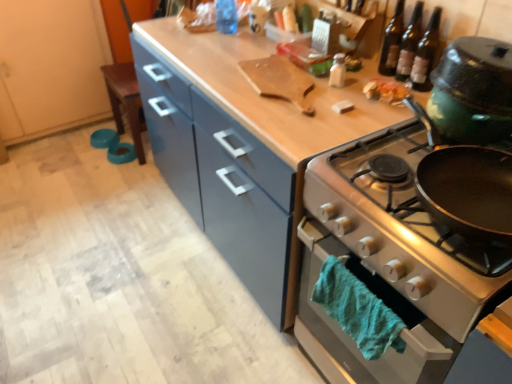
Question: Which direction should I rotate to look at transparent plastic bottle at upper center, acting as the first bottle starting from the left?

Choices:
 (A) right
 (B) left

Answer: (B)

Question: Is transparent plastic bottle at upper center, the second bottle when ordered from front to back, taller than teal fuzzy towel at lower right?

Choices:
 (A) no
 (B) yes

Answer: (B)

Question: Is transparent plastic bottle at upper center, which appears as the 2th bottle when ordered from the bottom, wider than teal fuzzy towel at lower right?

Choices:
 (A) no
 (B) yes

Answer: (B)

Question: Is transparent plastic bottle at upper center, which appears as the 2th bottle when ordered from the bottom, shorter than teal fuzzy towel at lower right?

Choices:
 (A) yes
 (B) no

Answer: (B)

Question: Is there a large distance between transparent plastic bottle at upper center, which appears as the 2th bottle when ordered from the bottom, and teal fuzzy towel at lower right?

Choices:
 (A) no
 (B) yes

Answer: (B)

Question: From a real-world perspective, is transparent plastic bottle at upper center, acting as the 1th bottle starting from the back, beneath teal fuzzy towel at lower right?

Choices:
 (A) yes
 (B) no

Answer: (B)

Question: Is transparent plastic bottle at upper center, the second bottle when ordered from front to back, closer to the viewer compared to teal fuzzy towel at lower right?

Choices:
 (A) yes
 (B) no

Answer: (B)

Question: Can you confirm if shiny plastic container at upper right is taller than translucent glass bottles at upper right, which is counted as the 1th beer bottle, starting from the right?

Choices:
 (A) yes
 (B) no

Answer: (B)

Question: From a real-world perspective, is shiny plastic container at upper right located higher than translucent glass bottles at upper right, which is counted as the 1th beer bottle, starting from the right?

Choices:
 (A) no
 (B) yes

Answer: (A)

Question: From the image's perspective, does shiny plastic container at upper right appear higher than translucent glass bottles at upper right, placed as the 2th beer bottle when sorted from left to right?

Choices:
 (A) no
 (B) yes

Answer: (A)

Question: Does shiny plastic container at upper right have a greater width compared to translucent glass bottles at upper right, placed as the 2th beer bottle when sorted from left to right?

Choices:
 (A) yes
 (B) no

Answer: (A)

Question: Considering the relative sizes of shiny plastic container at upper right and translucent glass bottles at upper right, which is counted as the 1th beer bottle, starting from the right, in the image provided, is shiny plastic container at upper right bigger than translucent glass bottles at upper right, which is counted as the 1th beer bottle, starting from the right,?

Choices:
 (A) yes
 (B) no

Answer: (B)

Question: From a real-world perspective, is shiny plastic container at upper right under translucent glass bottles at upper right, which is counted as the 1th beer bottle, starting from the right?

Choices:
 (A) no
 (B) yes

Answer: (B)

Question: From a real-world perspective, is silver metallic oven at right located higher than translucent glass bottles at upper right, which is counted as the 1th beer bottle, starting from the right?

Choices:
 (A) yes
 (B) no

Answer: (B)